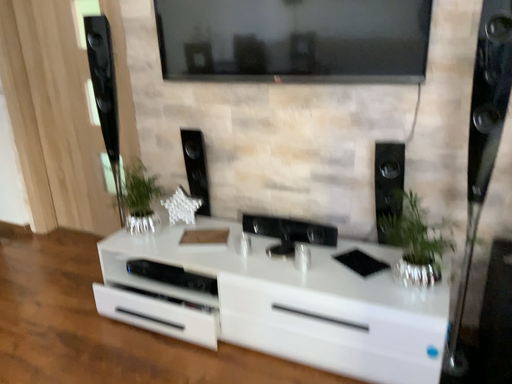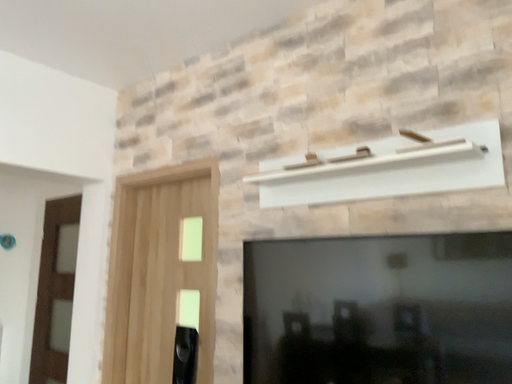
Question: How did the camera likely rotate when shooting the video?

Choices:
 (A) rotated downward
 (B) rotated upward

Answer: (B)